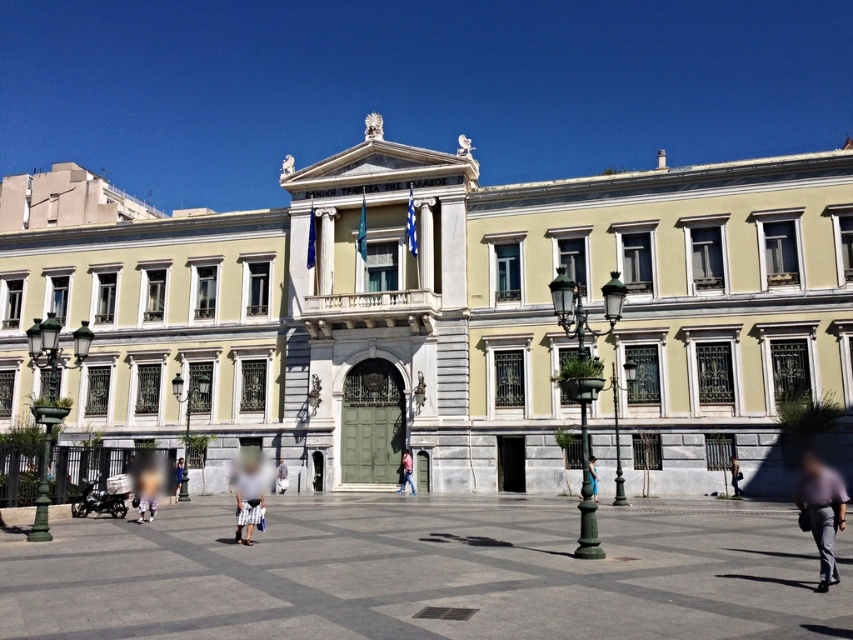
You are standing on the smooth stone pavement at center and looking down at the pink fabric pants at center. Which object is lower in height?

The pink fabric pants at center are lower in height compared to the smooth stone pavement at center.

You are standing in front of the grand neoclassical building and notice two points marked on its facade. The first point is at coordinates point [25,593] and the second is at point [463,612]. Which point is closer to you?

Point [25,593] is further to the camera than point [463,612]. Therefore, point [463,612] is closer to you.